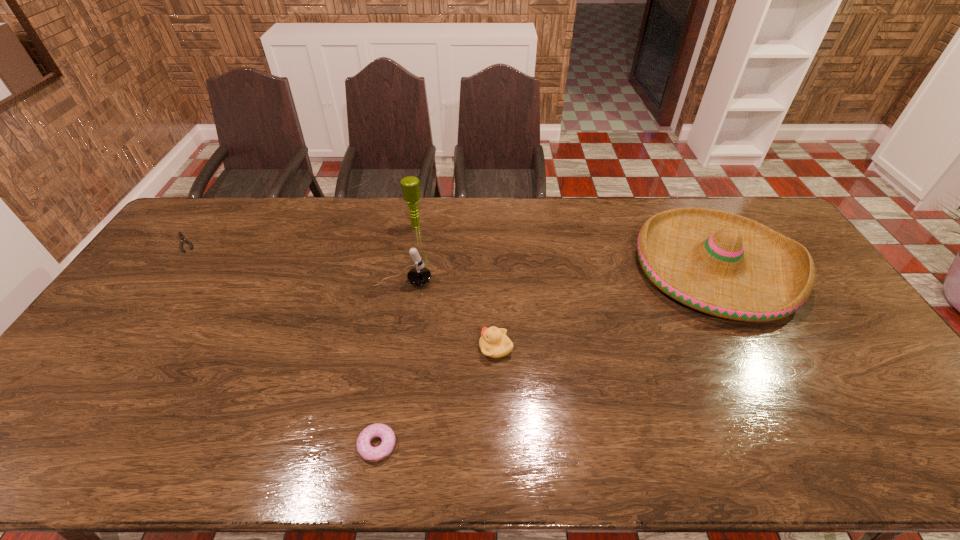
Locate an element on the screen. pliers at the far edge is located at coordinates pyautogui.click(x=181, y=236).

Identify the location of object that is positioned at the near edge. (372, 454).

You are a GUI agent. You are given a task and a screenshot of the screen. Output one action in this format:
    pyautogui.click(x=<x>, y=<y>)
    Task: Click on the object positioned at the left edge
    The width and height of the screenshot is (960, 540).
    Given the screenshot: What is the action you would take?
    coord(181,236)

Locate an element on the screen. object present at the right edge is located at coordinates (719, 263).

Find the location of a particular element. Image resolution: width=960 pixels, height=540 pixels. object that is at the far left corner is located at coordinates (181, 236).

This screenshot has height=540, width=960. I want to click on object present at the far right corner, so click(x=719, y=263).

Where is `free point at the far edge`? The image size is (960, 540). free point at the far edge is located at coordinates (660, 199).

Image resolution: width=960 pixels, height=540 pixels. I want to click on blank space at the left edge of the desktop, so click(196, 239).

The image size is (960, 540). In the image, there is a desktop. Find the location of `free region at the right edge`. free region at the right edge is located at coordinates (x=869, y=345).

In the image, there is a desktop. Where is `vacant region at the far left corner`? vacant region at the far left corner is located at coordinates (216, 207).